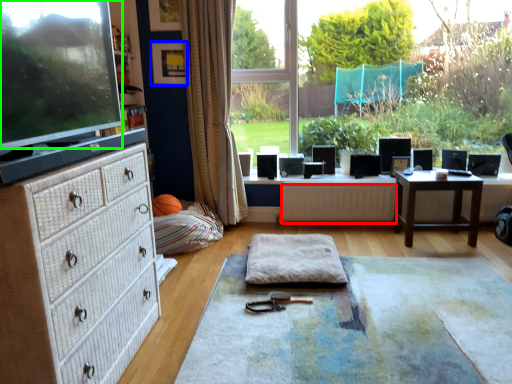
Question: Estimate the real-world distances between objects in this image. Which object is farther from radiator (highlighted by a red box), picture frame (highlighted by a blue box) or computer monitor (highlighted by a green box)?

Choices:
 (A) picture frame
 (B) computer monitor

Answer: (B)